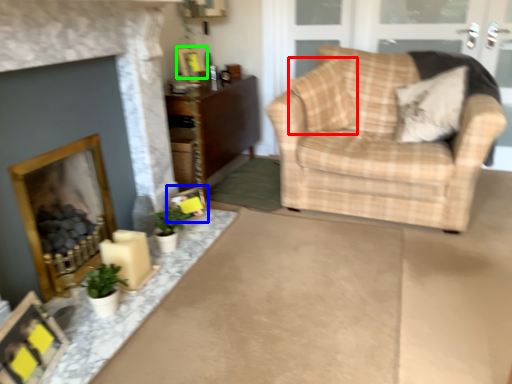
Question: Which object is positioned closest to pillow (highlighted by a red box)? Select from picture frame (highlighted by a blue box) and picture frame (highlighted by a green box).

Choices:
 (A) picture frame
 (B) picture frame

Answer: (B)